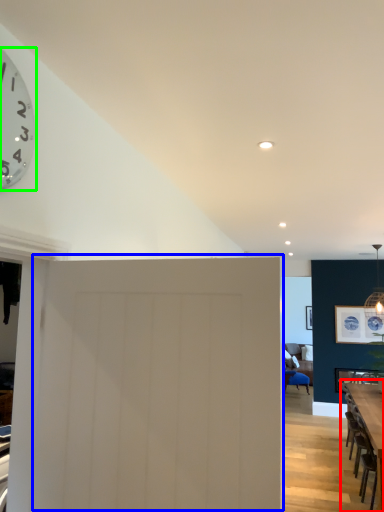
Question: Estimate the real-world distances between objects in this image. Which object is farther from table (highlighted by a red box), door (highlighted by a blue box) or wall clock (highlighted by a green box)?

Choices:
 (A) door
 (B) wall clock

Answer: (B)